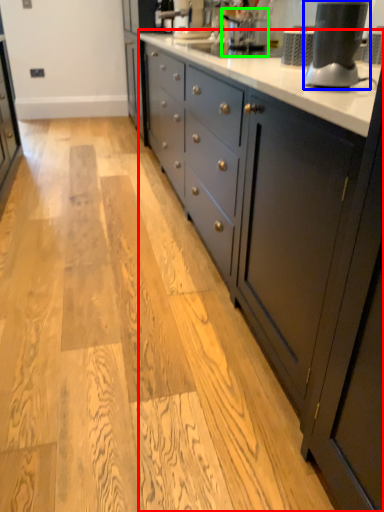
Question: Considering the real-world distances, which object is farthest from countertop (highlighted by a red box)? home appliance (highlighted by a blue box) or coffee machine (highlighted by a green box)?

Choices:
 (A) home appliance
 (B) coffee machine

Answer: (B)